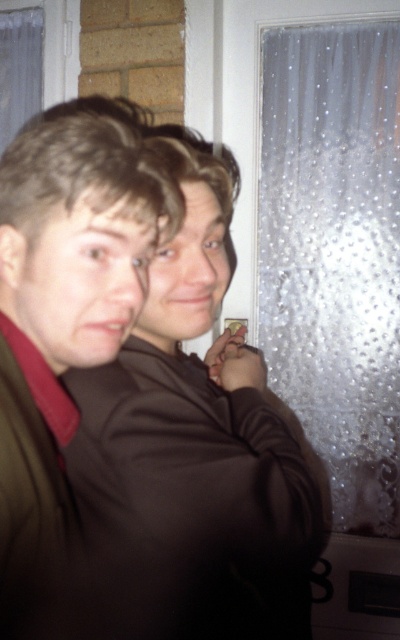
You are standing in the room and want to place a small plant exactly at the center of the room. The center is marked at point 0.5, 0.5. Is the brown matte jacket at center located closer to the center than 0.1 units in any direction?

The brown matte jacket at center is located at point [148,396]. The distance to the center point [200,320] is sqrt of squared differences in x and y coordinates. The x difference is 0.12, y difference is 0.13. The distance is sqrt of 0.0144 plus 0.0169 equals sqrt of 0.0313 which is approximately 0.177, which is more than 0.1 units. So the jacket is not closer than 0.1 units to the center in any direction.

You are a photographer trying to capture a clear shot of the brown matte jacket at center and the frosted glass curtain at right. Since the jacket is closer, will it appear larger in the photo compared to the curtain?

The brown matte jacket at center is closer to the viewer than the frosted glass curtain at right, so yes, it will appear larger in the photo.

You are an interior designer assessing the lighting in this room. You notice the brown matte jacket at center and the frosted glass curtain at right. Which object is closer to the light source emitting through the frosted glass?

The frosted glass curtain at right is closer to the light source because it is positioned above the brown matte jacket at center, meaning the jacket is further away from the light source emitting through the frosted glass.